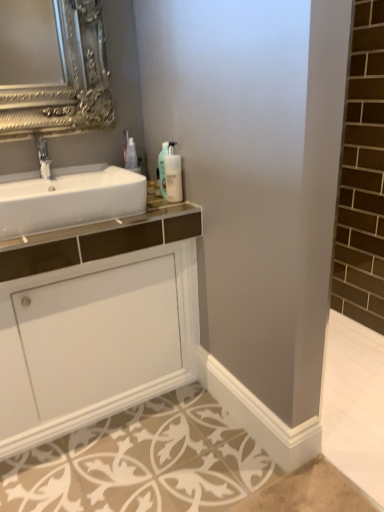
At what (x,y) coordinates should I click in order to perform the action: click on vacant space to the right of white painted wood baseboard at lower center. Please return your answer as a coordinate pair (x, y). Looking at the image, I should click on (347, 429).